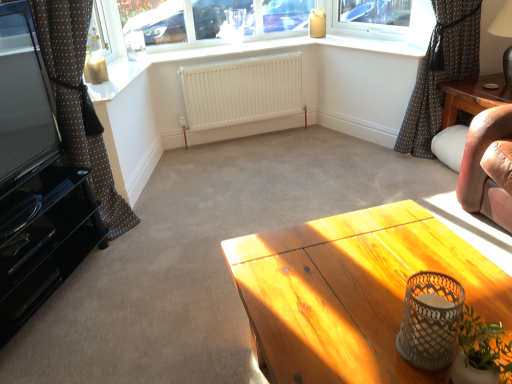
Question: Can you confirm if matte white window sill at upper center is thinner than brown polka dot fabric at left, which is counted as the 2th curtain, starting from the right?

Choices:
 (A) no
 (B) yes

Answer: (B)

Question: From the image's perspective, is matte white window sill at upper center under brown polka dot fabric at left, which is counted as the 2th curtain, starting from the right?

Choices:
 (A) yes
 (B) no

Answer: (B)

Question: From a real-world perspective, is matte white window sill at upper center positioned under brown polka dot fabric at left, the first curtain positioned from the left, based on gravity?

Choices:
 (A) yes
 (B) no

Answer: (B)

Question: Does matte white window sill at upper center have a smaller size compared to brown polka dot fabric at left, which is counted as the 2th curtain, starting from the right?

Choices:
 (A) no
 (B) yes

Answer: (B)

Question: From a real-world perspective, is matte white window sill at upper center over brown polka dot fabric at left, which is counted as the 2th curtain, starting from the right?

Choices:
 (A) yes
 (B) no

Answer: (A)

Question: Considering the positions of point (274, 72) and point (334, 46), is point (274, 72) closer or farther from the camera than point (334, 46)?

Choices:
 (A) closer
 (B) farther

Answer: (B)

Question: In the image, is white matte radiator at center positioned in front of or behind matte white window sill at upper center?

Choices:
 (A) behind
 (B) front

Answer: (A)

Question: From the image's perspective, is white matte radiator at center above or below matte white window sill at upper center?

Choices:
 (A) above
 (B) below

Answer: (B)

Question: Looking at their shapes, would you say white matte radiator at center is wider or thinner than matte white window sill at upper center?

Choices:
 (A) thin
 (B) wide

Answer: (A)

Question: Considering their positions, is white matte vase at lower right located in front of or behind brown polka dot fabric at left, which is counted as the 2th curtain, starting from the right?

Choices:
 (A) behind
 (B) front

Answer: (B)

Question: Is white matte vase at lower right wider or thinner than brown polka dot fabric at left, which is counted as the 2th curtain, starting from the right?

Choices:
 (A) wide
 (B) thin

Answer: (B)

Question: In terms of size, does white matte vase at lower right appear bigger or smaller than brown polka dot fabric at left, which is counted as the 2th curtain, starting from the right?

Choices:
 (A) big
 (B) small

Answer: (B)

Question: Visually, is white matte vase at lower right positioned to the left or to the right of brown polka dot fabric at left, the first curtain positioned from the left?

Choices:
 (A) right
 (B) left

Answer: (A)

Question: In terms of height, does brown dotted fabric at right, marked as the 2th curtain in a left-to-right arrangement, look taller or shorter compared to white matte radiator at center?

Choices:
 (A) tall
 (B) short

Answer: (A)

Question: From a real-world perspective, is brown dotted fabric at right, the first curtain positioned from the right, positioned above or below white matte radiator at center?

Choices:
 (A) above
 (B) below

Answer: (A)